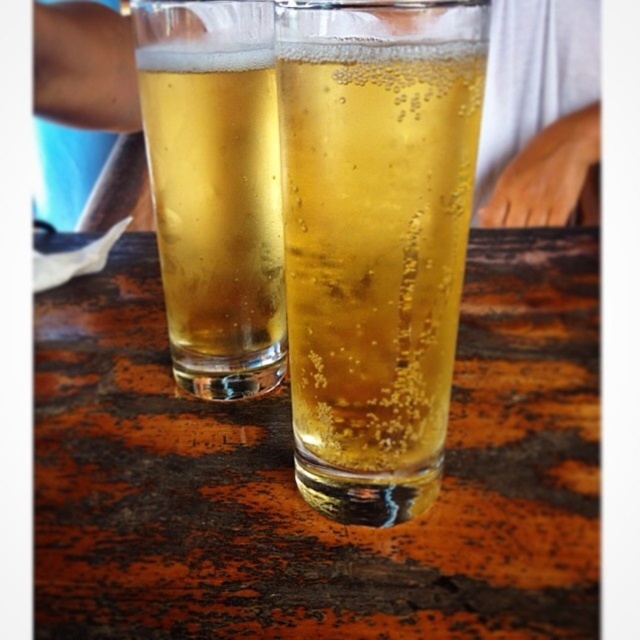
Which is below, wooden table at center or translucent glass at center?

wooden table at center is below.

Who is positioned more to the left, wooden table at center or translucent glass at center?

wooden table at center

The image size is (640, 640). Find the location of `wooden table at center`. wooden table at center is located at coordinates (292, 474).

Find the location of a particular element. The width and height of the screenshot is (640, 640). wooden table at center is located at coordinates (292, 474).

Can you confirm if wooden table at center is positioned above translucent glass at left?

Actually, wooden table at center is below translucent glass at left.

Describe the element at coordinates (292, 474) in the screenshot. I see `wooden table at center` at that location.

Locate an element on the screen. This screenshot has width=640, height=640. wooden table at center is located at coordinates (292, 474).

Locate an element on the screen. wooden table at center is located at coordinates (x=292, y=474).

Is translucent glass at center below translucent glass at left?

Indeed, translucent glass at center is positioned under translucent glass at left.

Who is more forward, (417,205) or (244,17)?

Positioned in front is point (417,205).

You are a GUI agent. You are given a task and a screenshot of the screen. Output one action in this format:
    pyautogui.click(x=<x>, y=<y>)
    Task: Click on the translucent glass at center
    
    Given the screenshot: What is the action you would take?
    pyautogui.click(x=376, y=240)

The image size is (640, 640). I want to click on translucent glass at center, so click(376, 240).